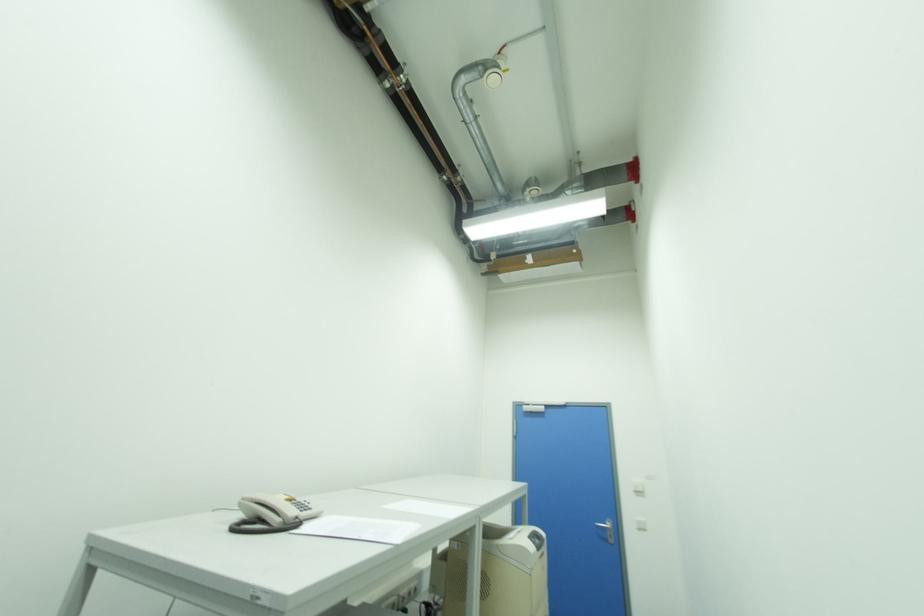
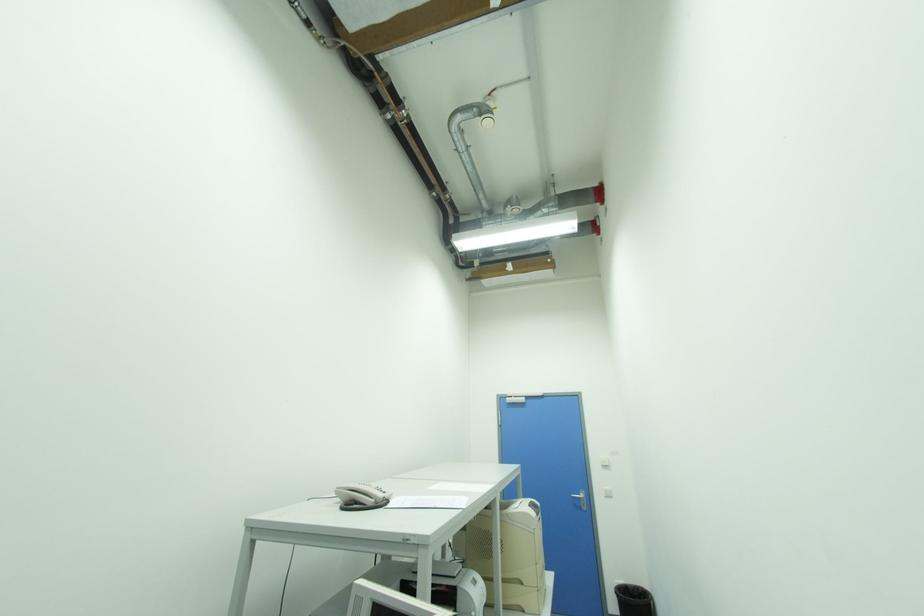
In a continuous first-person perspective shot, in which direction is the camera moving?

The cameraman moved toward left, backward.